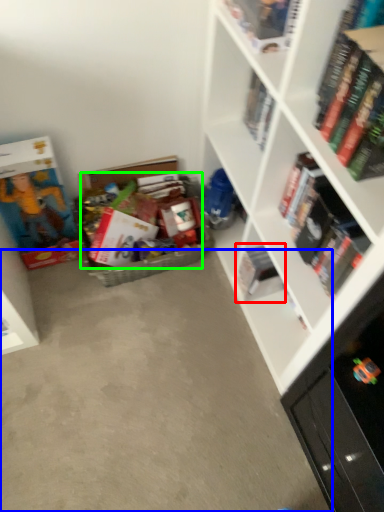
Question: Which is nearer to the book (highlighted by a red box)? concrete (highlighted by a blue box) or book (highlighted by a green box).

Choices:
 (A) concrete
 (B) book

Answer: (B)